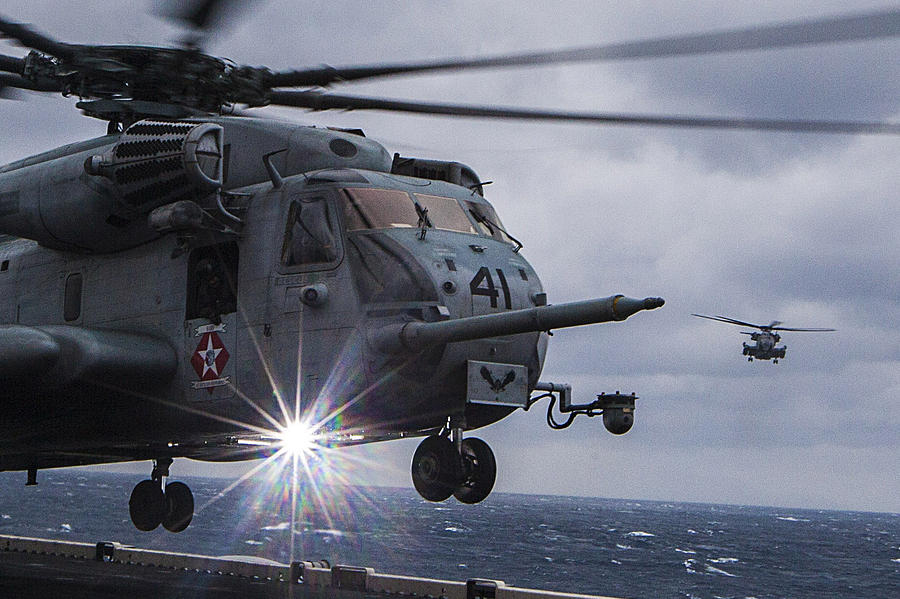
Identify the location of door. This screenshot has height=599, width=900. (216, 346).